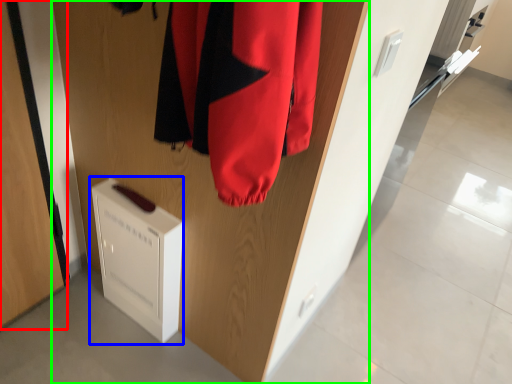
Question: Based on their relative distances, which object is nearer to door (highlighted by a red box)? Choose from appliance (highlighted by a blue box) and door (highlighted by a green box).

Choices:
 (A) appliance
 (B) door

Answer: (A)